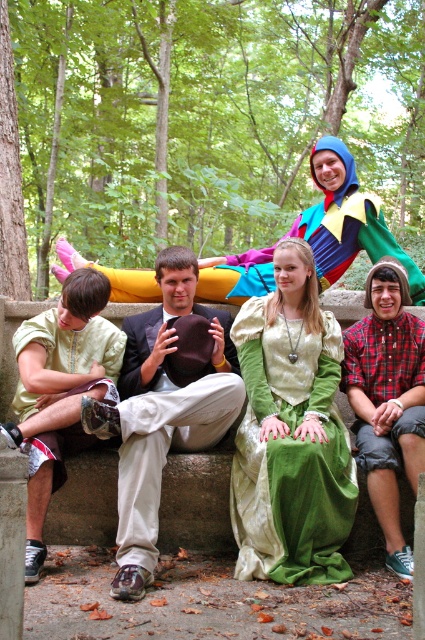
You are standing in front of the group of people on the stone bench. Which object is located at the coordinates point (59, 390)?

The point (59, 390) corresponds to the matte gold tunic at left.

You are a photographer trying to capture a group photo of the green linen dress at center and the multicolored fabric figure at upper center. Which of the two requires a wider lens to fully capture their entire figure in the frame?

The multicolored fabric figure at upper center requires a wider lens because its width is greater than the green linen dress at center.